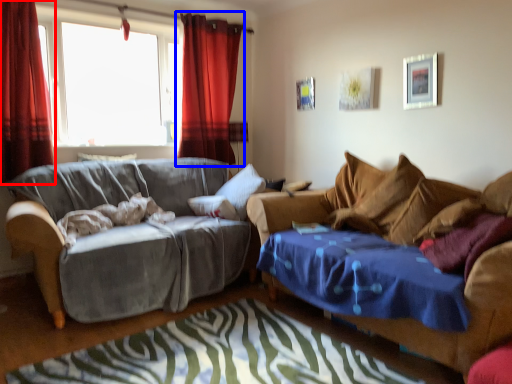
Question: Among these objects, which one is nearest to the camera, curtain (highlighted by a red box) or curtain (highlighted by a blue box)?

Choices:
 (A) curtain
 (B) curtain

Answer: (A)